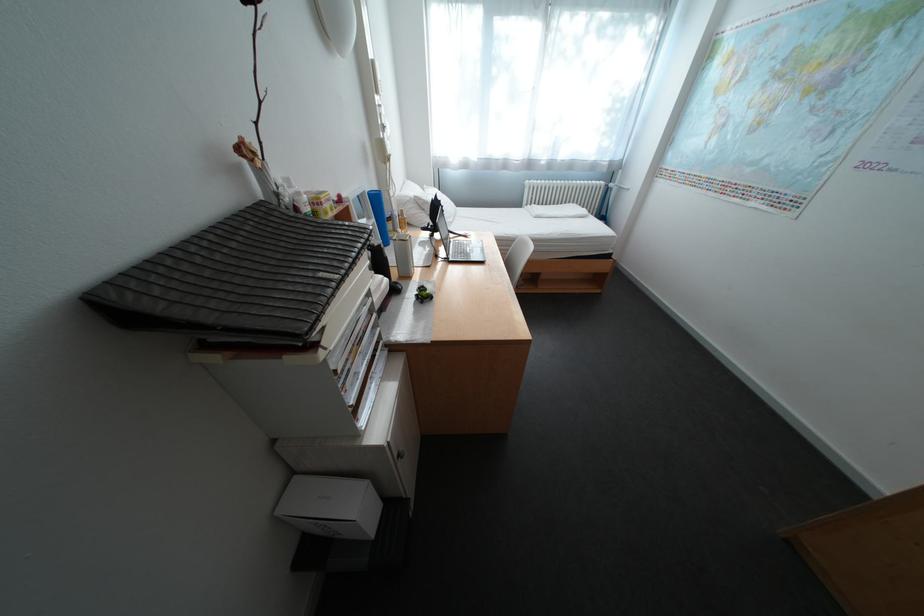
Locate an element on the screen. Image resolution: width=924 pixels, height=616 pixels. small cabinet knob is located at coordinates [399, 455].